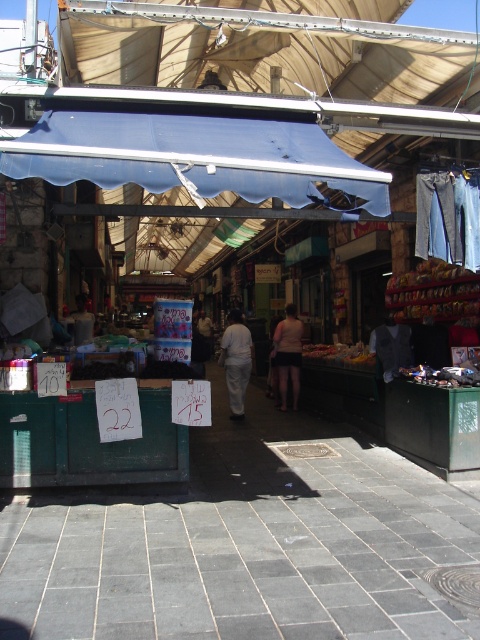
Does white cotton pants at center appear on the right side of light beige shorts at center?

Incorrect, white cotton pants at center is not on the right side of light beige shorts at center.

Does white cotton pants at center appear on the left side of light beige shorts at center?

Correct, you'll find white cotton pants at center to the left of light beige shorts at center.

This screenshot has height=640, width=480. Describe the element at coordinates (236, 362) in the screenshot. I see `white cotton pants at center` at that location.

Find the location of a particular element. This screenshot has height=640, width=480. white cotton pants at center is located at coordinates (236, 362).

Is blue fabric canopy at upper center smaller than white cotton pants at center?

No.

Does blue fabric canopy at upper center come behind white cotton pants at center?

No, it is not.

Which is behind, point (92, 172) or point (219, 355)?

The point (219, 355) is behind.

The height and width of the screenshot is (640, 480). I want to click on blue fabric canopy at upper center, so click(194, 156).

Which of these two, blue fabric canopy at upper center or light beige shorts at center, stands taller?

With more height is light beige shorts at center.

Does blue fabric canopy at upper center have a smaller size compared to light beige shorts at center?

Actually, blue fabric canopy at upper center might be larger than light beige shorts at center.

You are a GUI agent. You are given a task and a screenshot of the screen. Output one action in this format:
    pyautogui.click(x=<x>, y=<y>)
    Task: Click on the blue fabric canopy at upper center
    The height and width of the screenshot is (640, 480).
    Given the screenshot: What is the action you would take?
    pyautogui.click(x=194, y=156)